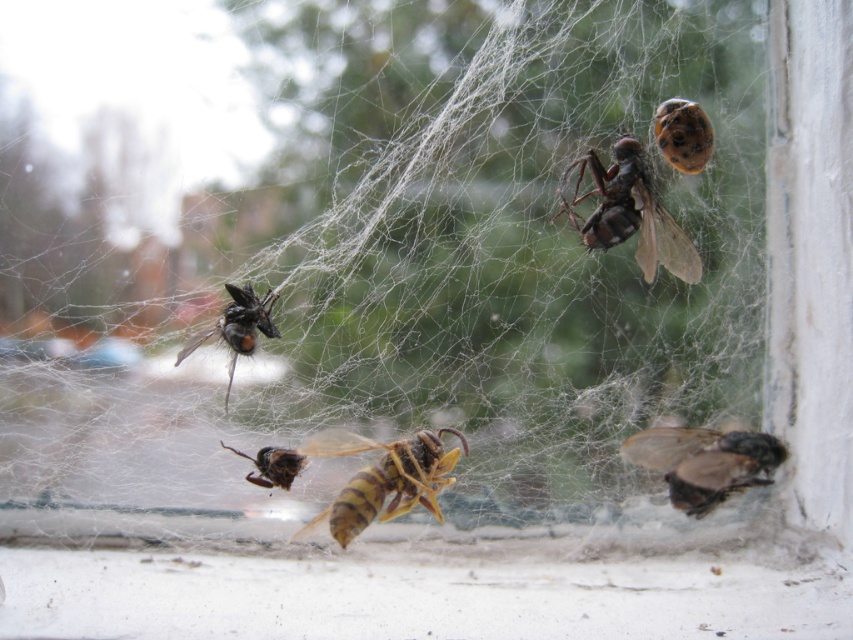
You are a tiny insect trying to escape from the spider web. You are currently at point A, which is at coordinate point A at point (x=602, y=186). You want to reach point B at point (x=701, y=492) to exit the web. However, you notice that point A is behind point B. Can you move directly from point A to point B without crossing any strands in front of point A?

Since point A at point (x=602, y=186) is behind point B at point (x=701, y=492), moving directly from point A to point B would require moving towards the direction of point B. However, since point A is behind point B, there might be strands between them that are in front of point A. Therefore, you cannot move directly without crossing strands in front of point A.

You are a small insect trying to escape from the spider web. You are currently at the brown fuzzy bee at lower right and want to reach the brown fuzzy bee at upper right. Which direction should you move to get closer to your target?

To reach the brown fuzzy bee at upper right from the brown fuzzy bee at lower right, you should move upward and to the right since the brown fuzzy bee at upper right is located in that direction relative to the brown fuzzy bee at lower right.

You are a small insect trying to escape from the web. You see the yellow striped wasp at center and the brown fuzzy bee at center. Which one is closer to you?

The yellow striped wasp at center is closer to the viewer than the brown fuzzy bee at center, so the yellow striped wasp at center is closer to you.